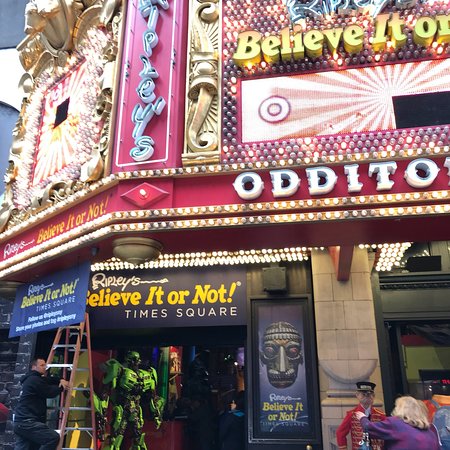
What are the coordinates of `ladder` in the screenshot? It's located at (75, 338).